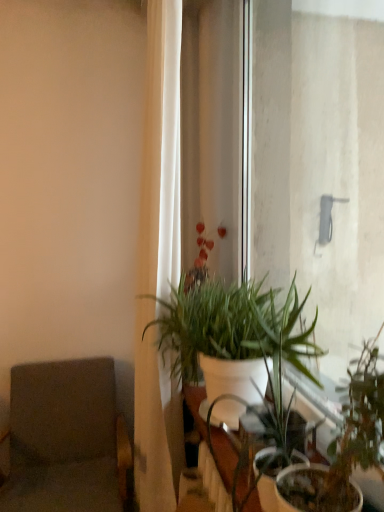
Question: Looking at their shapes, would you say white matte plant at center, which is the second houseplant in front-to-back order, is wider or thinner than gray fabric swivel chair at left?

Choices:
 (A) thin
 (B) wide

Answer: (A)

Question: From the image's perspective, is white matte plant at center, which is the second houseplant in front-to-back order, positioned above or below gray fabric swivel chair at left?

Choices:
 (A) above
 (B) below

Answer: (A)

Question: Which of these objects is positioned closest to the white glossy table at center?

Choices:
 (A) green matte plant at center, arranged as the second houseplant when viewed from the back
 (B) gray fabric swivel chair at left
 (C) white fabric curtain at left
 (D) white matte plant at center, the first houseplant when ordered from back to front

Answer: (D)

Question: Considering the real-world distances, which object is closest to the green matte plant at center, arranged as the second houseplant when viewed from the back?

Choices:
 (A) white glossy table at center
 (B) gray fabric swivel chair at left
 (C) white matte plant at center, the first houseplant when ordered from back to front
 (D) white fabric curtain at left

Answer: (A)